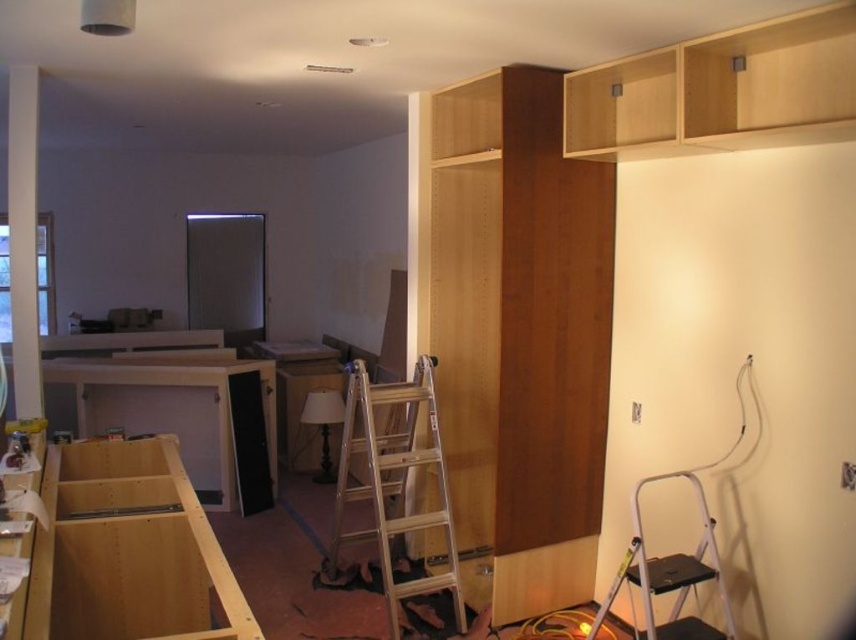
Question: Can you confirm if wooden ladder at center is positioned above metallic silver step ladder at lower right?

Choices:
 (A) no
 (B) yes

Answer: (B)

Question: Which point appears farthest from the camera in this image?

Choices:
 (A) (403, 497)
 (B) (726, 602)

Answer: (A)

Question: Is wooden ladder at center to the right of metallic silver step ladder at lower right from the viewer's perspective?

Choices:
 (A) yes
 (B) no

Answer: (B)

Question: Is wooden ladder at center wider than metallic silver step ladder at lower right?

Choices:
 (A) no
 (B) yes

Answer: (B)

Question: Which of the following is the farthest from the observer?

Choices:
 (A) wooden ladder at center
 (B) metallic silver step ladder at lower right

Answer: (A)

Question: Which point is farther from the camera taking this photo?

Choices:
 (A) (364, 384)
 (B) (611, 596)

Answer: (A)